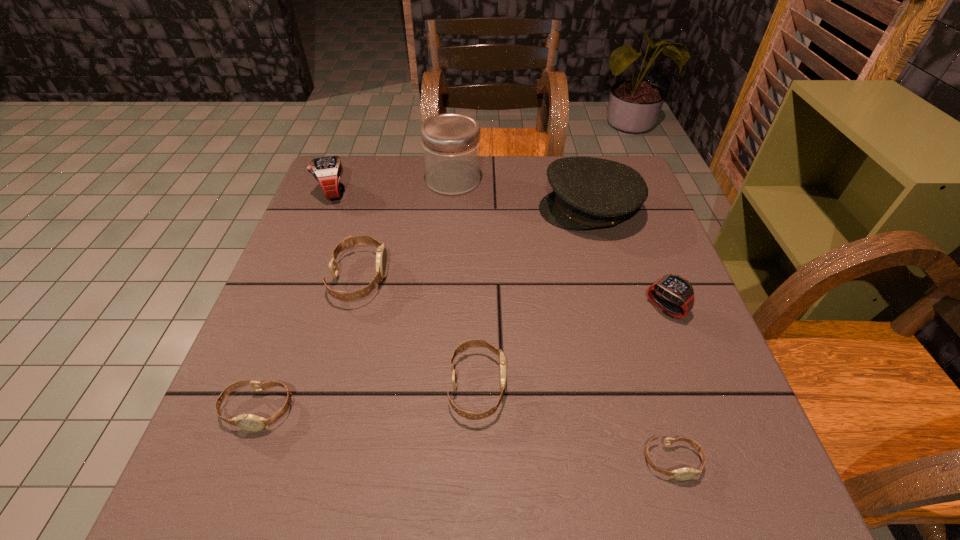
I want to click on jar, so click(x=450, y=142).

This screenshot has height=540, width=960. Identify the location of gray beret. (588, 192).

I want to click on the second tallest object, so click(x=588, y=192).

Where is `the farthest watch`? The width and height of the screenshot is (960, 540). the farthest watch is located at coordinates (327, 171).

This screenshot has width=960, height=540. In order to click on the tallest watch in this screenshot , I will do `click(327, 171)`.

At what (x,y) coordinates should I click in order to perform the action: click on the farthest beige watch. Please return your answer as a coordinate pair (x, y). This screenshot has width=960, height=540. Looking at the image, I should click on (381, 255).

Identify the location of the smaller red watch. (677, 289).

Where is `the right red watch`? The height and width of the screenshot is (540, 960). the right red watch is located at coordinates (677, 289).

Where is `the fourth watch from left to right`? This screenshot has width=960, height=540. the fourth watch from left to right is located at coordinates (462, 346).

Where is `the second biggest beige watch`? The width and height of the screenshot is (960, 540). the second biggest beige watch is located at coordinates (462, 346).